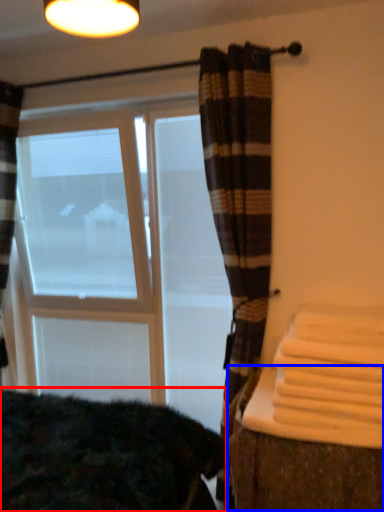
Question: Which of the following is the closest to the observer, bedding (highlighted by a red box) or table (highlighted by a blue box)?

Choices:
 (A) bedding
 (B) table

Answer: (A)